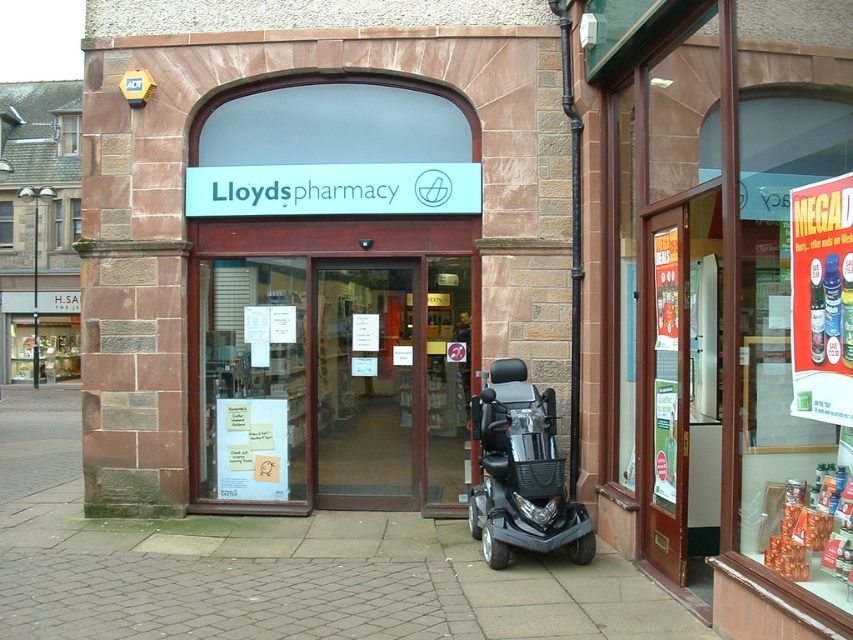
Question: Which point is closer to the camera?

Choices:
 (A) black plastic mobility scooter at lower center
 (B) gray brick pavement at center

Answer: (B)

Question: Which object is the farthest from the gray brick pavement at center?

Choices:
 (A) black plastic mobility scooter at lower center
 (B) transparent glass door at center

Answer: (B)

Question: Where is transparent glass door at center located in relation to black plastic mobility scooter at lower center in the image?

Choices:
 (A) above
 (B) below

Answer: (A)

Question: Which is farther from the black plastic mobility scooter at lower center?

Choices:
 (A) gray brick pavement at center
 (B) transparent glass door at center

Answer: (B)

Question: Does gray brick pavement at center have a larger size compared to transparent glass door at center?

Choices:
 (A) no
 (B) yes

Answer: (A)

Question: Does transparent glass door at center have a larger size compared to black plastic mobility scooter at lower center?

Choices:
 (A) yes
 (B) no

Answer: (A)